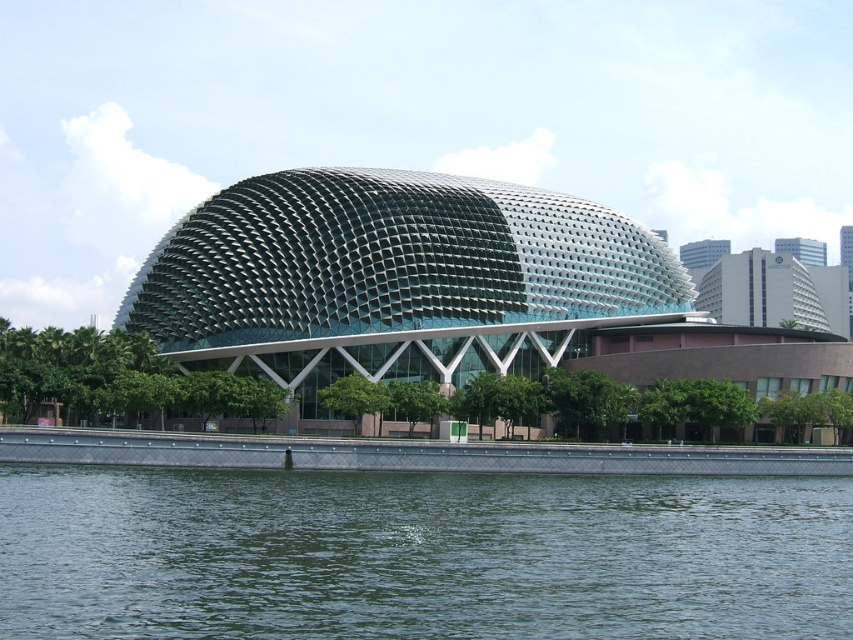
Does green water at lower center appear under green textured dome at center?

Yes.

Is green water at lower center bigger than green textured dome at center?

Actually, green water at lower center might be smaller than green textured dome at center.

Locate an element on the screen. green water at lower center is located at coordinates (419, 554).

I want to click on green water at lower center, so pyautogui.click(x=419, y=554).